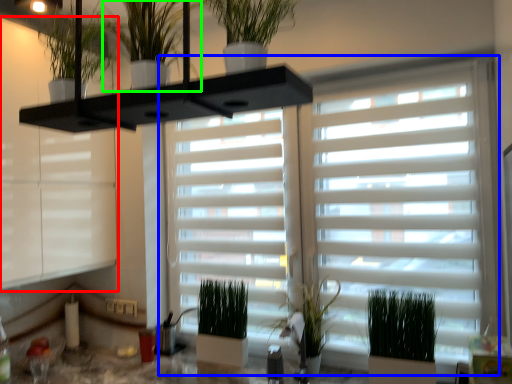
Question: Estimate the real-world distances between objects in this image. Which object is farther from window frame (highlighted by a red box), window blind (highlighted by a blue box) or houseplant (highlighted by a green box)?

Choices:
 (A) window blind
 (B) houseplant

Answer: (B)